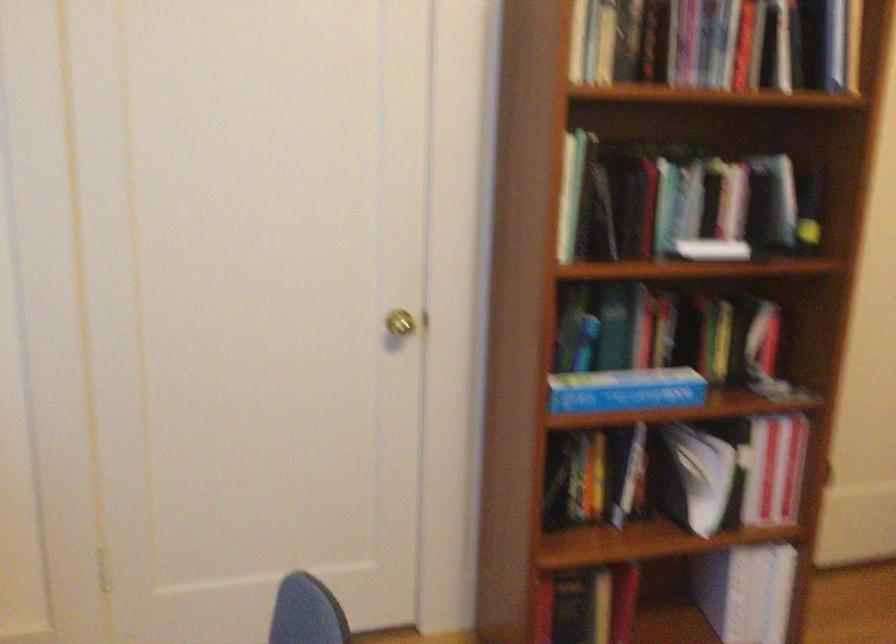
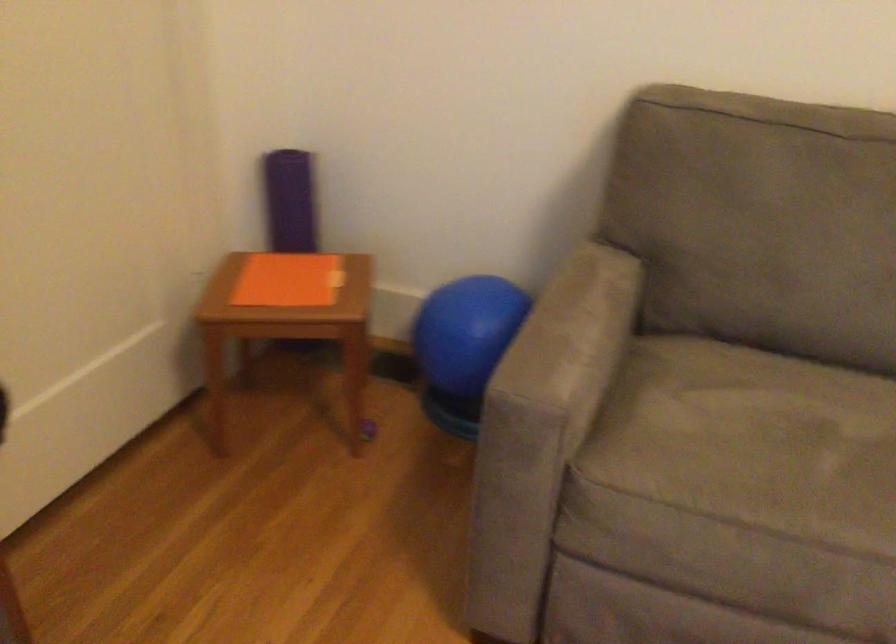
The images are taken continuously from a first-person perspective. In which direction is your viewpoint rotating?

The rotation direction of the camera is right-down.